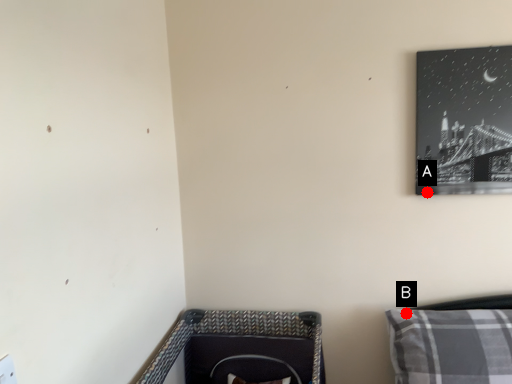
Question: Two points are circled on the image, labeled by A and B beside each circle. Which of the following is the farthest from the observer?

Choices:
 (A) A is further
 (B) B is further

Answer: (A)